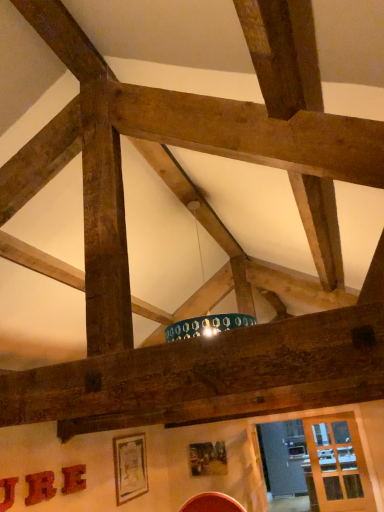
What do you see at coordinates (130, 467) in the screenshot?
I see `gold-framed picture at lower center` at bounding box center [130, 467].

I want to click on gold-framed picture at lower center, so click(130, 467).

This screenshot has width=384, height=512. What are the coordinates of `gold-framed picture at lower center` in the screenshot? It's located at (130, 467).